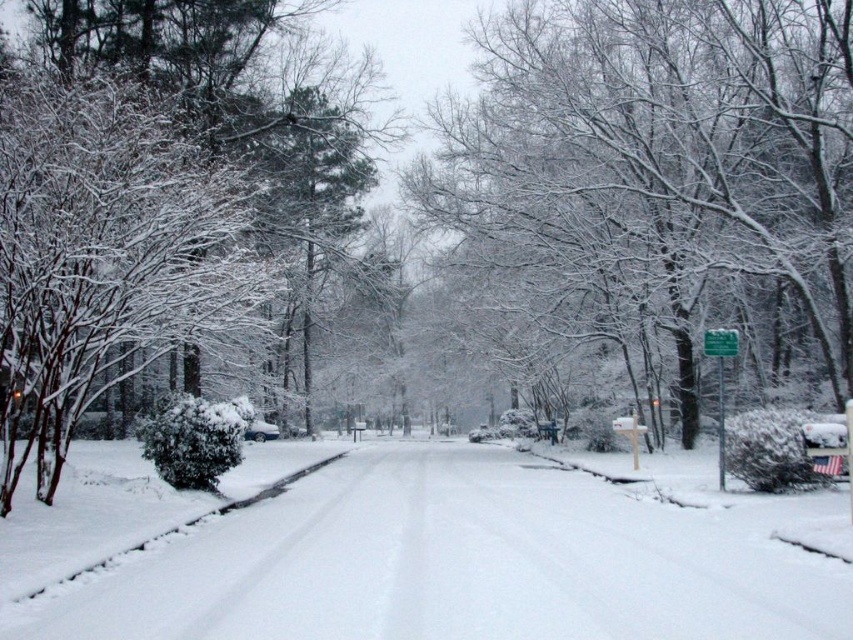
Is white fluffy snow at center to the right of snow-covered branches at center from the viewer's perspective?

Incorrect, white fluffy snow at center is not on the right side of snow-covered branches at center.

Who is more forward, [839,620] or [651,128]?

Point [839,620]

Is point (759, 604) more distant than point (724, 243)?

No, it is not.

Find the location of a particular element. This screenshot has width=853, height=640. white fluffy snow at center is located at coordinates (463, 563).

Who is positioned more to the right, snow-covered branches at center or green plastic sign at right?

green plastic sign at right is more to the right.

Does point (830, 72) lie in front of point (706, 348)?

No.

Locate an element on the screen. snow-covered branches at center is located at coordinates (663, 148).

This screenshot has height=640, width=853. What are the coordinates of `snow-covered branches at center` in the screenshot? It's located at (663, 148).

Is white snow-covered tree at left to the left of green plastic sign at center right from the viewer's perspective?

Indeed, white snow-covered tree at left is positioned on the left side of green plastic sign at center right.

Between white snow-covered tree at left and green plastic sign at center right, which one has more height?

With more height is white snow-covered tree at left.

Which is behind, point (74, 35) or point (718, 349)?

Positioned behind is point (74, 35).

This screenshot has height=640, width=853. In order to click on white snow-covered tree at left in this screenshot , I will do click(132, 198).